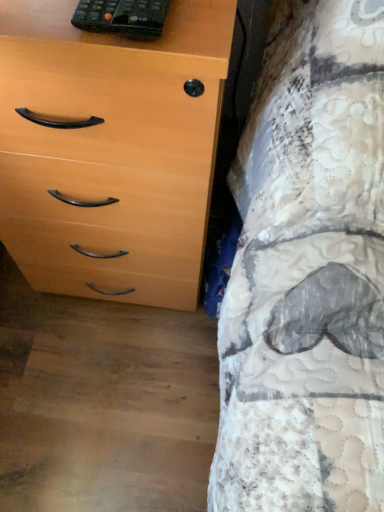
Identify the location of free space in front of light wood/veneer chest of drawers at left. This screenshot has width=384, height=512. (103, 389).